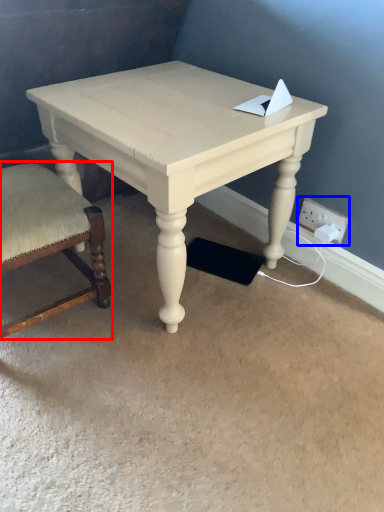
Question: Which object is closer to the camera taking this photo, chair (highlighted by a red box) or electric outlet (highlighted by a blue box)?

Choices:
 (A) chair
 (B) electric outlet

Answer: (A)